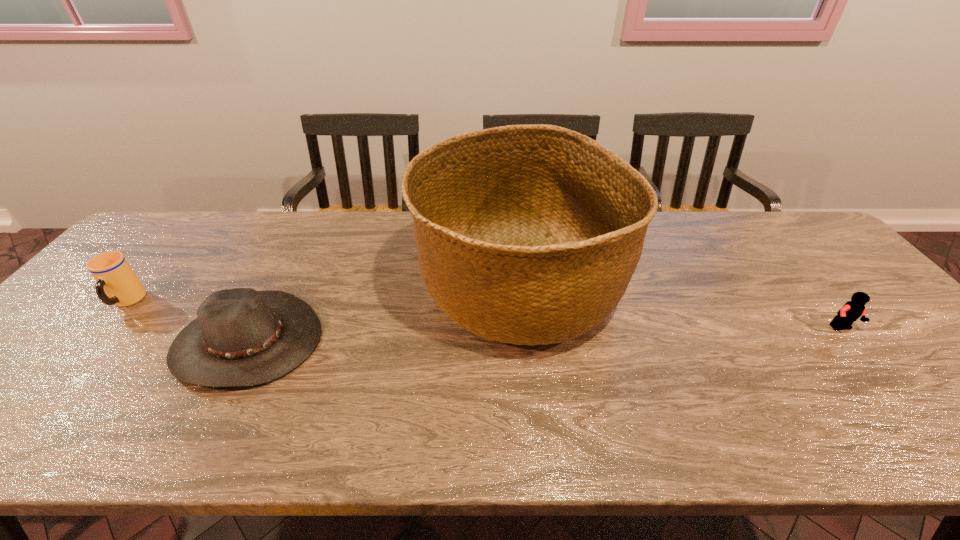
The width and height of the screenshot is (960, 540). What are the coordinates of `object that is at the left edge` in the screenshot? It's located at (117, 284).

Where is `object at the right edge`? This screenshot has height=540, width=960. object at the right edge is located at coordinates (851, 311).

This screenshot has height=540, width=960. Identify the location of vacant space at the far edge of the desktop. (672, 240).

The height and width of the screenshot is (540, 960). Identify the location of vacant area at the near edge. (797, 448).

You are a GUI agent. You are given a task and a screenshot of the screen. Output one action in this format:
    pyautogui.click(x=<x>, y=<y>)
    Task: Click on the free space at the left edge
    This screenshot has width=960, height=540.
    Given the screenshot: What is the action you would take?
    pyautogui.click(x=162, y=258)

In the image, there is a desktop. Where is `free space at the right edge`? This screenshot has width=960, height=540. free space at the right edge is located at coordinates (793, 269).

In order to click on free point at the far right corner in this screenshot , I will do `click(828, 250)`.

Where is `blank space at the near right corner of the desktop`? The image size is (960, 540). blank space at the near right corner of the desktop is located at coordinates (955, 426).

Locate an element on the screen. The image size is (960, 540). blank region between the second object from left to right and the leftmost object is located at coordinates (187, 321).

At what (x,y) coordinates should I click in order to perform the action: click on free spot between the tallest object and the second object from left to right. Please return your answer as a coordinate pair (x, y). Image resolution: width=960 pixels, height=540 pixels. Looking at the image, I should click on (383, 314).